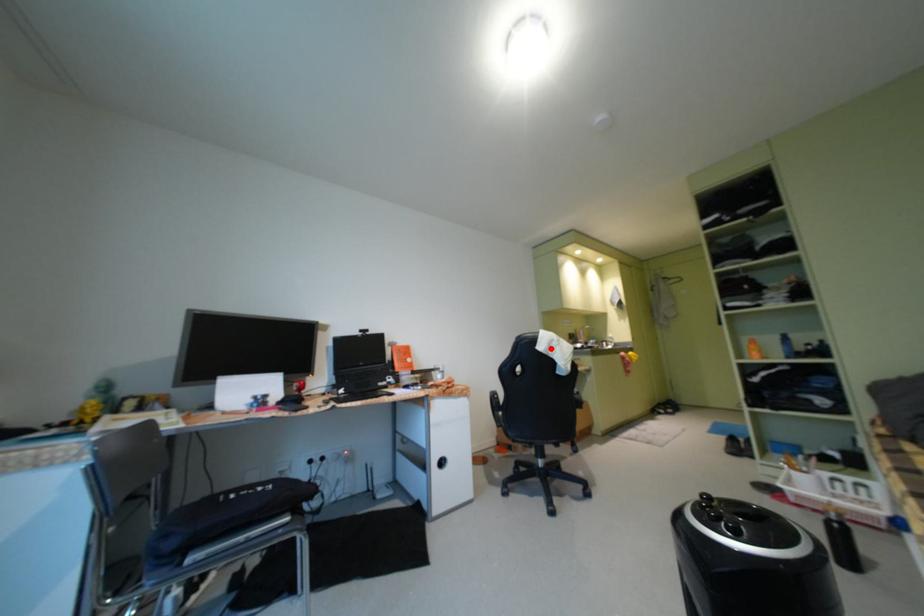
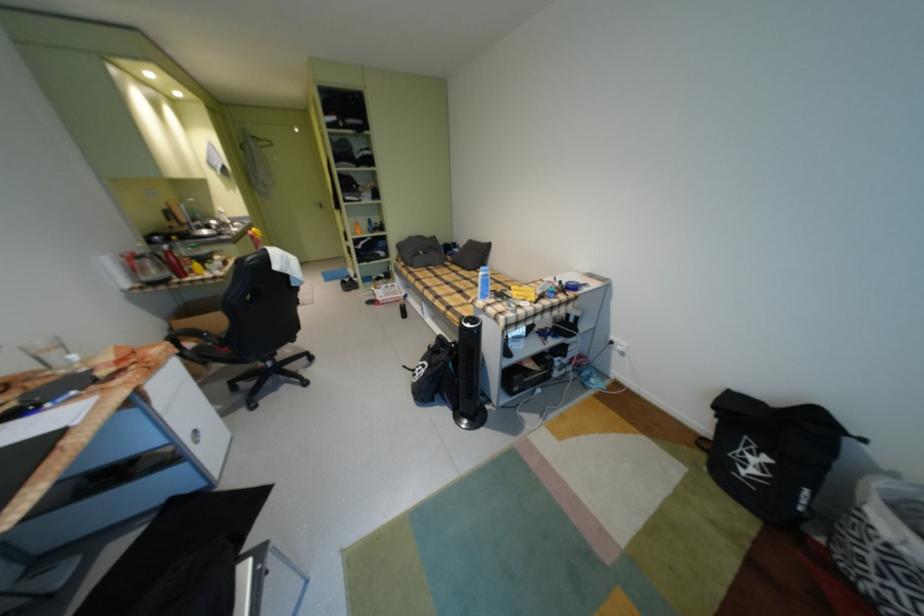
Question: I am providing you with two images of the same scene from different viewpoints. Image1 has a red point marked. In image2, the corresponding 3D location appears at what relative position? Reply with the corresponding letter.

Choices:
 (A) Closer
 (B) Farther

Answer: (A)